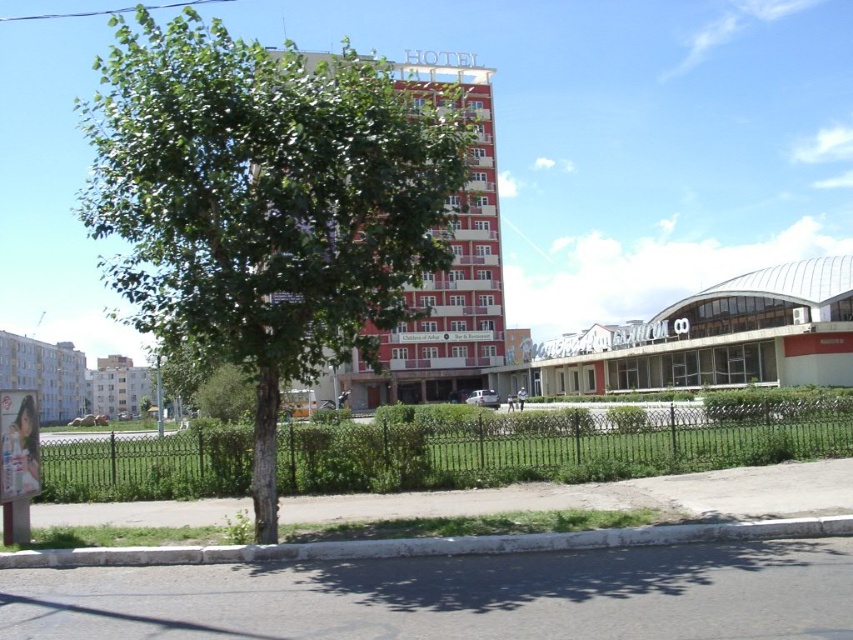
You are standing in the middle of the street looking at the scene. Which building is closer to your left side, the red brick building at center or the white concrete building at lower left?

The white concrete building at lower left is closer to your left side because it is positioned to the left of the red brick building at center.

You are standing at the origin point in the image and want to locate the red brick building at center. What are its coordinates?

The coordinates of the red brick building at center are at point [451,262].

You are a delivery person trying to see the hotel building in the background. You are currently standing behind the green wrought iron fence at lower center and the white concrete curb at lower center. Which object is blocking your view more because of its height?

The green wrought iron fence at lower center is blocking your view more because it is much taller than the white concrete curb at lower center.